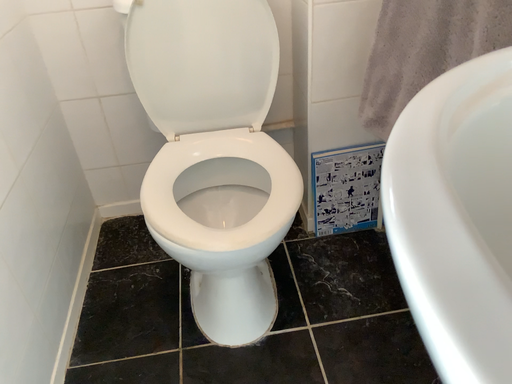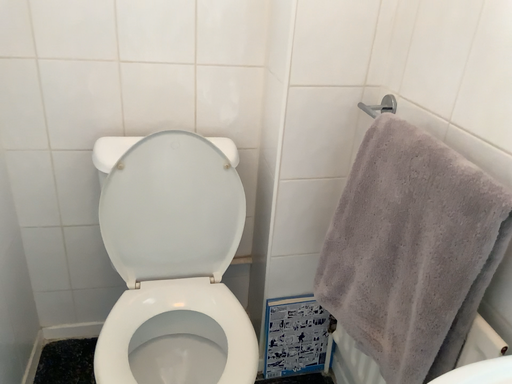
Question: How did the camera likely rotate when shooting the video?

Choices:
 (A) rotated right
 (B) rotated left

Answer: (A)